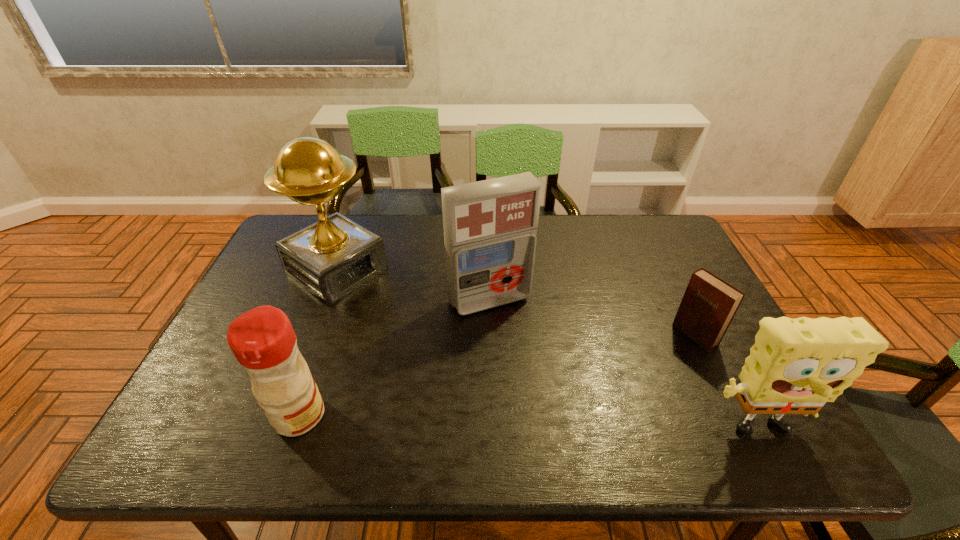
You are a GUI agent. You are given a task and a screenshot of the screen. Output one action in this format:
    pyautogui.click(x=<x>, y=<y>)
    Task: Click on the free space between the shortest object and the third object from left to right
    
    Given the screenshot: What is the action you would take?
    pyautogui.click(x=592, y=318)

I want to click on vacant space that is in between the award and the sponge, so click(543, 352).

You are a GUI agent. You are given a task and a screenshot of the screen. Output one action in this format:
    pyautogui.click(x=<x>, y=<y>)
    Task: Click on the unoccupied area between the sponge and the shortest object
    The height and width of the screenshot is (540, 960).
    Given the screenshot: What is the action you would take?
    pyautogui.click(x=723, y=383)

Where is `free space between the first-aid kit and the condiment`? The width and height of the screenshot is (960, 540). free space between the first-aid kit and the condiment is located at coordinates (395, 357).

Identify the location of vacant area between the diary and the award. This screenshot has width=960, height=540. (516, 303).

Where is `free point between the first-aid kit and the award`? The height and width of the screenshot is (540, 960). free point between the first-aid kit and the award is located at coordinates (414, 286).

Locate an element on the screen. The width and height of the screenshot is (960, 540). free space between the sponge and the diary is located at coordinates (723, 383).

You are a GUI agent. You are given a task and a screenshot of the screen. Output one action in this format:
    pyautogui.click(x=<x>, y=<y>)
    Task: Click on the vacant space in between the fourth shortest object and the diary
    The width and height of the screenshot is (960, 540).
    Given the screenshot: What is the action you would take?
    pyautogui.click(x=592, y=318)

Locate an element on the screen. The width and height of the screenshot is (960, 540). free space between the award and the sponge is located at coordinates (543, 352).

Find the location of `blank region between the first-aid kit and the shortest object`. blank region between the first-aid kit and the shortest object is located at coordinates tap(592, 318).